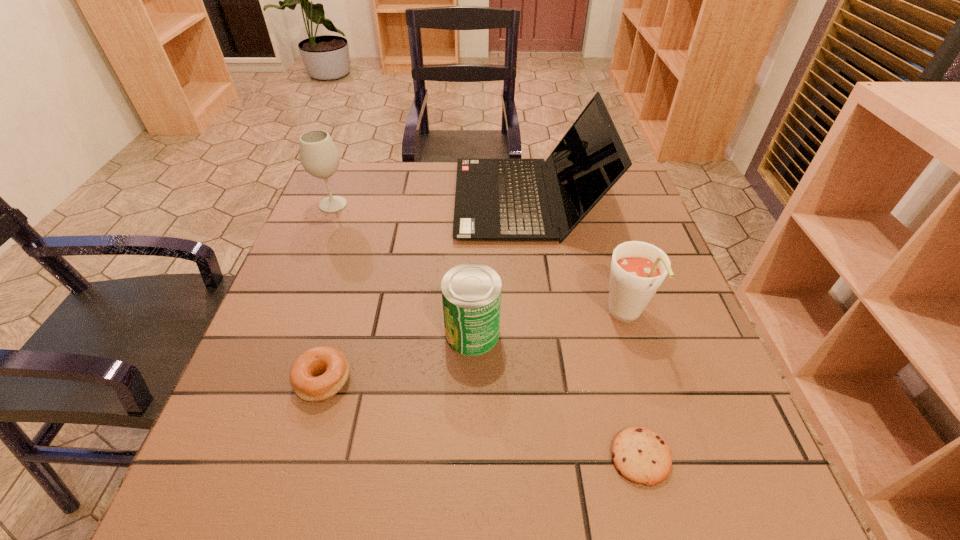
This screenshot has height=540, width=960. I want to click on laptop computer, so click(495, 199).

The width and height of the screenshot is (960, 540). I want to click on the leftmost object, so click(x=319, y=156).

What are the coordinates of `root beer` in the screenshot? It's located at (638, 269).

In order to click on can in this screenshot , I will do `click(471, 292)`.

The height and width of the screenshot is (540, 960). I want to click on the second shortest object, so click(330, 361).

Where is `the fifth farthest object`? the fifth farthest object is located at coordinates (330, 361).

You are a GUI agent. You are given a task and a screenshot of the screen. Output one action in this format:
    pyautogui.click(x=<x>, y=<y>)
    Task: Click on the shortest object
    
    Given the screenshot: What is the action you would take?
    pyautogui.click(x=640, y=455)

Find the location of `cookie`. cookie is located at coordinates (640, 455).

Identify the location of vacant region located on the screen of the laptop computer. This screenshot has height=540, width=960. coord(430,199).

The image size is (960, 540). Identify the location of vacant space located 0.120m on the screen of the laptop computer. (413, 199).